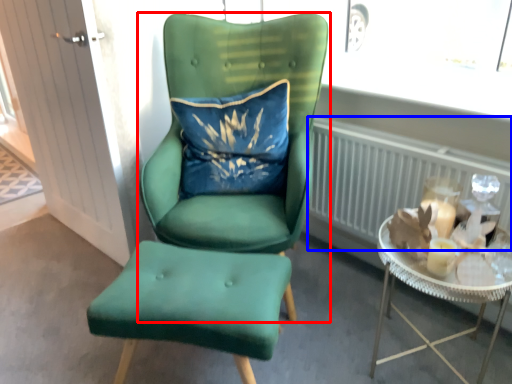
Question: Among these objects, which one is nearest to the camera, chair (highlighted by a red box) or radiator (highlighted by a blue box)?

Choices:
 (A) chair
 (B) radiator

Answer: (A)